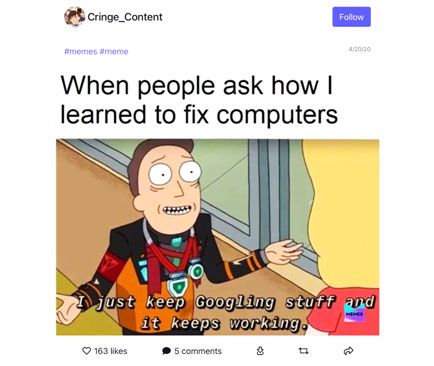
Image resolution: width=434 pixels, height=366 pixels. I want to click on floor, so click(90, 326).